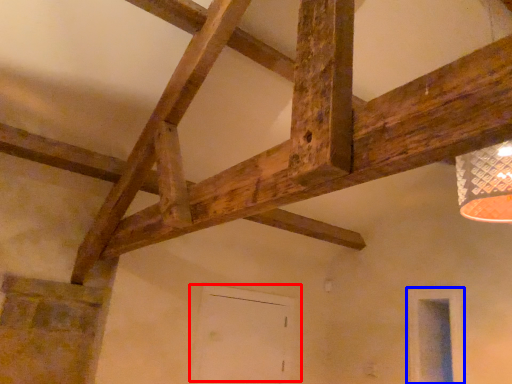
Question: Which object is closer to the camera taking this photo, door (highlighted by a red box) or window (highlighted by a blue box)?

Choices:
 (A) door
 (B) window

Answer: (B)